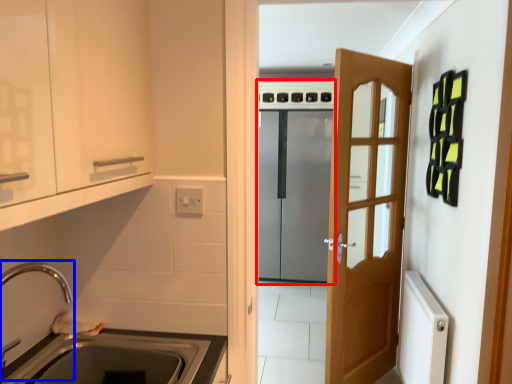
Question: Which point is closer to the camera, appliance (highlighted by a red box) or faucet (highlighted by a blue box)?

Choices:
 (A) appliance
 (B) faucet

Answer: (B)